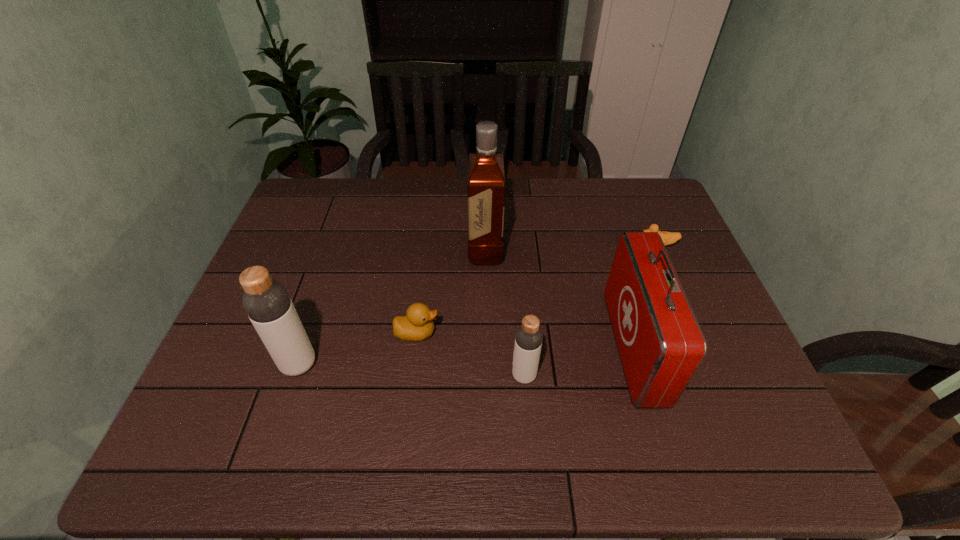
Where is `vacant region at the near right corner`? vacant region at the near right corner is located at coordinates (733, 377).

The width and height of the screenshot is (960, 540). Find the location of `empty space that is in between the left bottle and the second object from right to left`. empty space that is in between the left bottle and the second object from right to left is located at coordinates (466, 356).

What are the coordinates of `free space between the tallest object and the fifth object from left to right` in the screenshot? It's located at (560, 299).

Where is `free area in between the right duckling and the right bottle`? free area in between the right duckling and the right bottle is located at coordinates (590, 312).

Find the location of a particular element. The image size is (960, 540). vacant area that lies between the fifth object from left to right and the left bottle is located at coordinates (466, 356).

Image resolution: width=960 pixels, height=540 pixels. Find the location of `vacant area that lies between the first-aid kit and the tallest object`. vacant area that lies between the first-aid kit and the tallest object is located at coordinates (560, 299).

The image size is (960, 540). Identify the location of unoccupied position between the leftmost object and the first-aid kit. (466, 356).

Identify the location of vacant region between the third object from left to right and the shorter duckling. This screenshot has height=540, width=960. (571, 248).

Select which object appears as the closest to the left bottle. Please provide its 2D coordinates. Your answer should be formatted as a tuple, i.e. [(x, y)], where the tuple contains the x and y coordinates of a point satisfying the conditions above.

[(417, 324)]

The image size is (960, 540). Identify the location of object that is the closest to the shortest object. (661, 345).